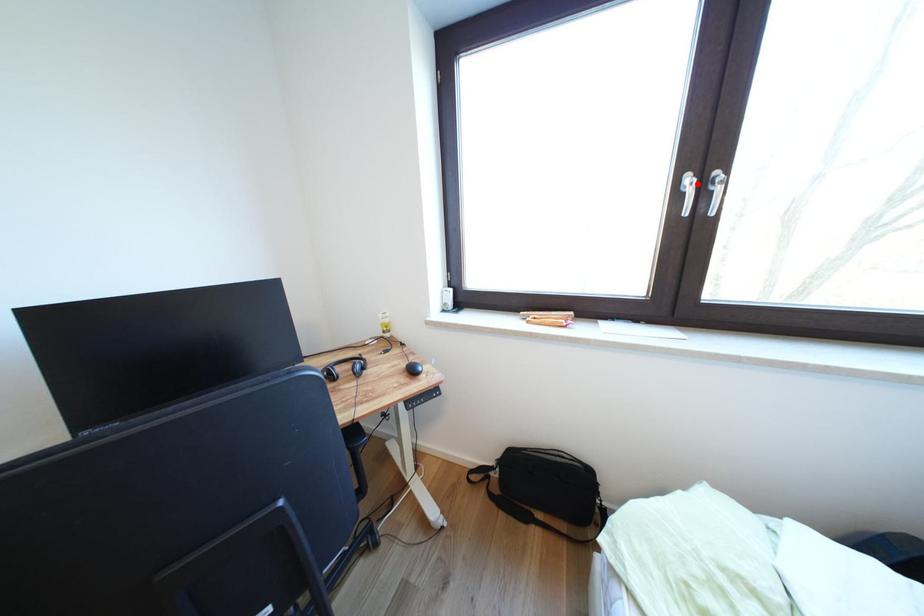
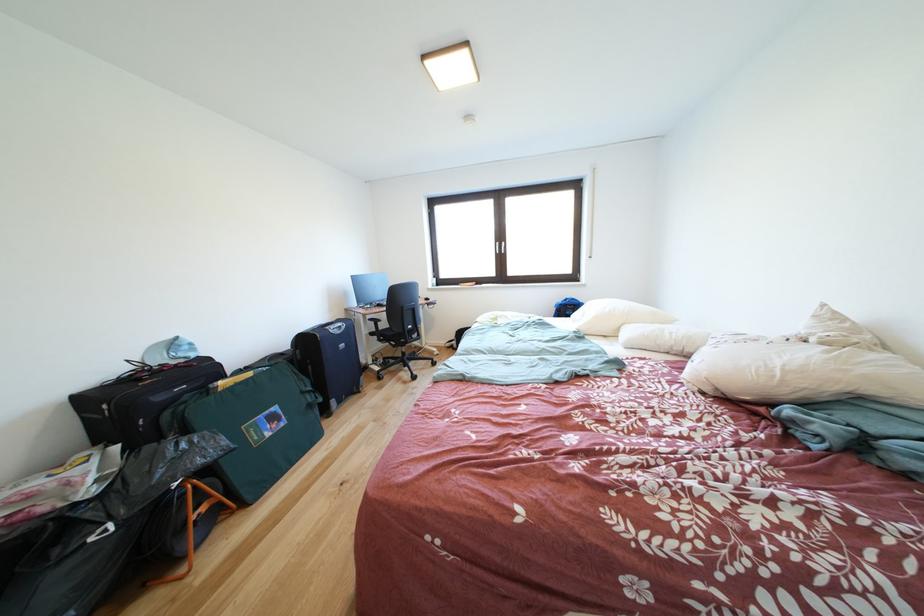
Question: I am providing you with two images of the same scene from different viewpoints. In image1, a red point is highlighted. Considering the same 3D point in image2, which of the following is correct?

Choices:
 (A) It is closer
 (B) It is farther

Answer: (A)